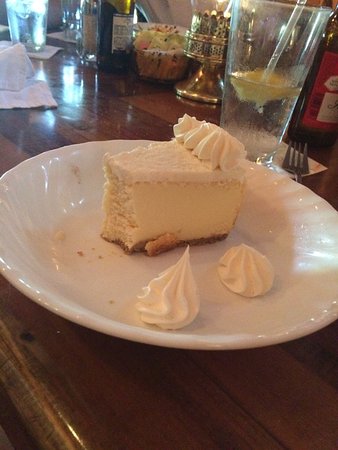
Where is `glass`? This screenshot has height=450, width=338. glass is located at coordinates (256, 61).